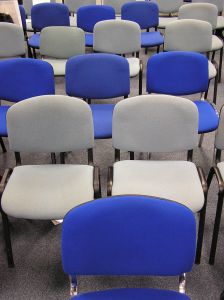
At what (x,y) coordinates should I click in order to perform the action: click on chair in front row. Please return your answer as a coordinate pair (x, y). The image size is (224, 300). Looking at the image, I should click on (120, 253).